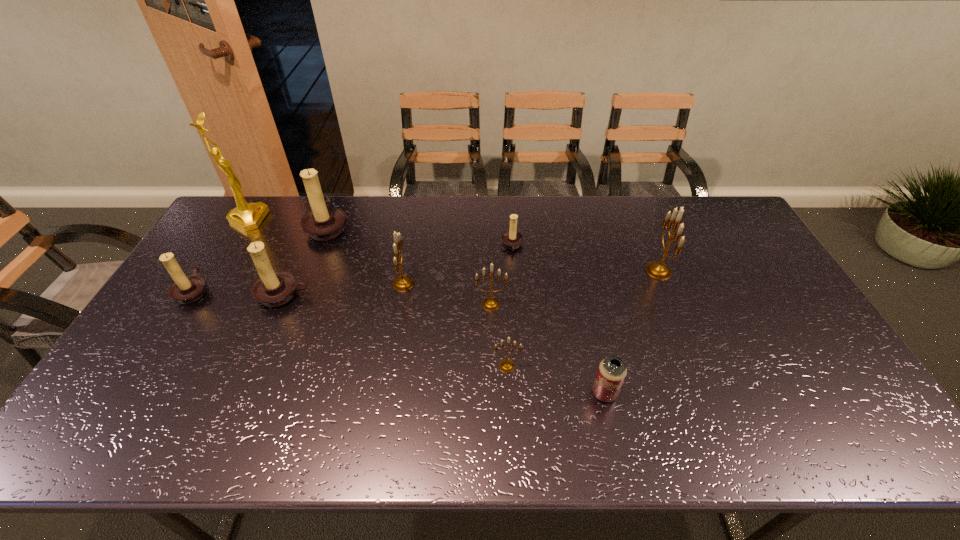
In order to click on candelabrum that is the third closest one to the second smallest gold candelabrum in this screenshot , I will do `click(511, 239)`.

Point out which candelabrum is positioned as the fifth nearest to the biggest brown candle holder. Please provide its 2D coordinates. Your answer should be formatted as a tuple, i.e. [(x, y)], where the tuple contains the x and y coordinates of a point satisfying the conditions above.

[(511, 239)]

The image size is (960, 540). In order to click on brown candle holder that is the third closest one to the third biggest brown candle holder in this screenshot , I will do `click(511, 239)`.

Choose which brown candle holder is the nearest neighbor to the rightmost brown candle holder. Please provide its 2D coordinates. Your answer should be formatted as a tuple, i.e. [(x, y)], where the tuple contains the x and y coordinates of a point satisfying the conditions above.

[(324, 222)]

Identify which gold candelabrum is the third nearest to the second biggest brown candle holder. Please provide its 2D coordinates. Your answer should be formatted as a tuple, i.e. [(x, y)], where the tuple contains the x and y coordinates of a point satisfying the conditions above.

[(506, 366)]

The height and width of the screenshot is (540, 960). Identify the location of the closest gold candelabrum to the golden award. (402, 283).

At what (x,y) coordinates should I click in order to perform the action: click on free region that satisfies the following two spatial constraints: 1. on the wick of the second smallest gold candelabrum; 2. on the left side of the third smallest brown candle holder. Please return your answer as a coordinate pair (x, y). Looking at the image, I should click on (279, 304).

At what (x,y) coordinates should I click in order to perform the action: click on blank space that satisfies the following two spatial constraints: 1. on the wick of the third biggest gold candelabrum; 2. on the right side of the third smallest brown candle holder. Please return your answer as a coordinate pair (x, y). The width and height of the screenshot is (960, 540). Looking at the image, I should click on (279, 304).

The image size is (960, 540). Find the location of `free space that satisfies the following two spatial constraints: 1. on the front-facing side of the leftmost gold candelabrum; 2. on the left side of the golden award`. free space that satisfies the following two spatial constraints: 1. on the front-facing side of the leftmost gold candelabrum; 2. on the left side of the golden award is located at coordinates pos(208,284).

Where is `free space that satisfies the following two spatial constraints: 1. on the wick of the biggest brown candle holder; 2. on the wick of the second biggest brown candle holder`? This screenshot has width=960, height=540. free space that satisfies the following two spatial constraints: 1. on the wick of the biggest brown candle holder; 2. on the wick of the second biggest brown candle holder is located at coordinates (300, 295).